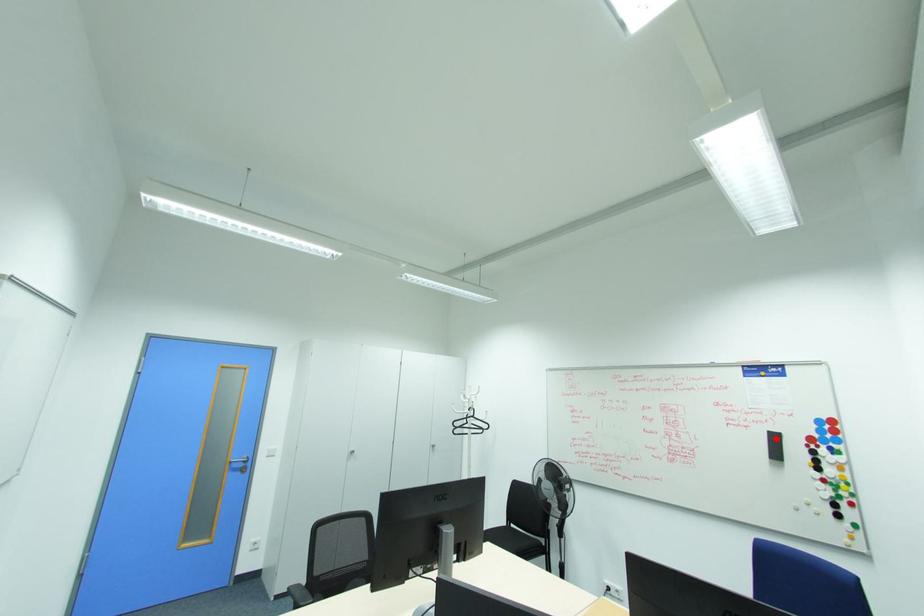
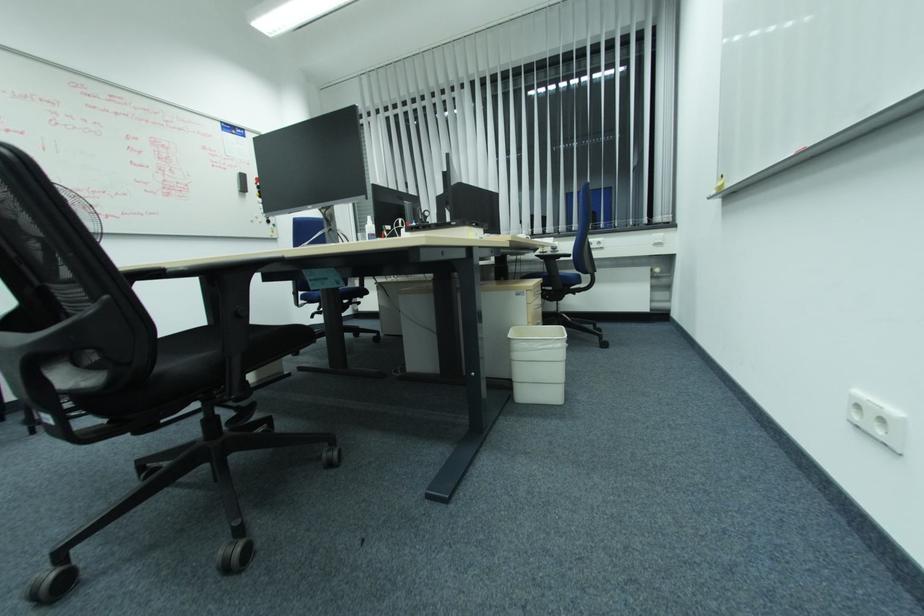
Find the pixel in the second image that matches the highlighted location in the first image.

(244, 177)